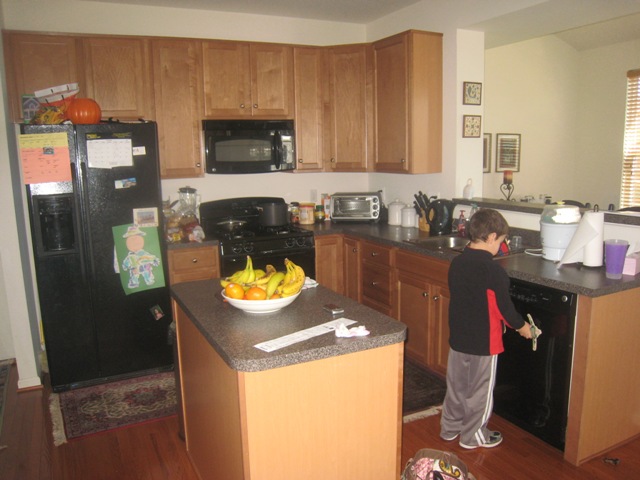
You are a GUI agent. You are given a task and a screenshot of the screen. Output one action in this format:
    pyautogui.click(x=<x>, y=<y>)
    Task: Click on the cupboard
    
    Given the screenshot: What is the action you would take?
    pyautogui.click(x=173, y=84), pyautogui.click(x=390, y=86)